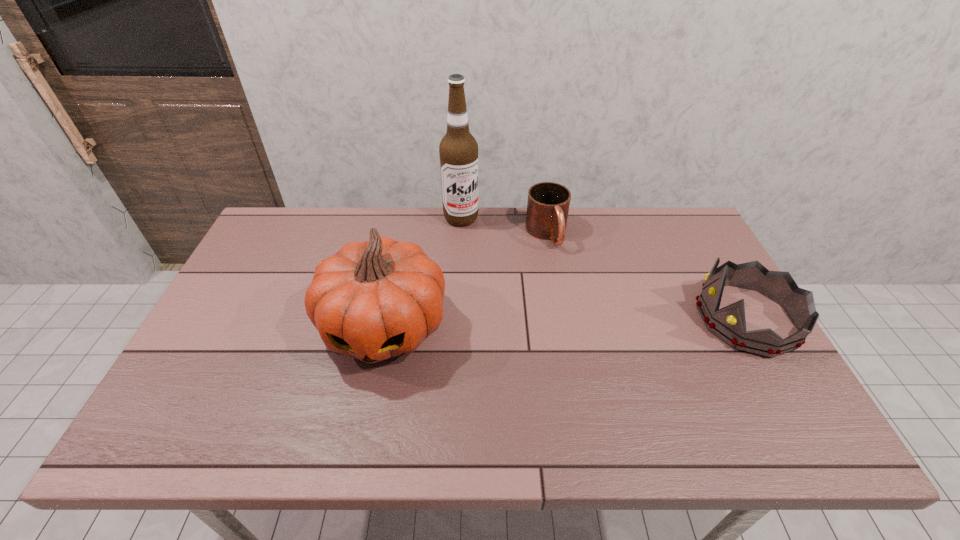
The image size is (960, 540). I want to click on the third shortest object, so click(373, 300).

Where is `tiara`? tiara is located at coordinates (728, 323).

Find the location of `the second shortest object`. the second shortest object is located at coordinates (728, 323).

The width and height of the screenshot is (960, 540). In order to click on the shortest object in this screenshot , I will do `click(548, 203)`.

The height and width of the screenshot is (540, 960). In order to click on mug in this screenshot , I will do `click(548, 203)`.

Find the location of `alcohol`. alcohol is located at coordinates (458, 150).

The height and width of the screenshot is (540, 960). In order to click on vacant space situated on the face of the second tallest object in this screenshot , I will do `click(369, 404)`.

Locate an element on the screen. This screenshot has width=960, height=540. vacant region located at the front of the tiara with jewels is located at coordinates (637, 319).

Identify the location of free space located 0.180m at the front of the tiara with jewels. (630, 319).

The height and width of the screenshot is (540, 960). Identify the location of free space located 0.080m at the front of the tiara with jewels. (666, 319).